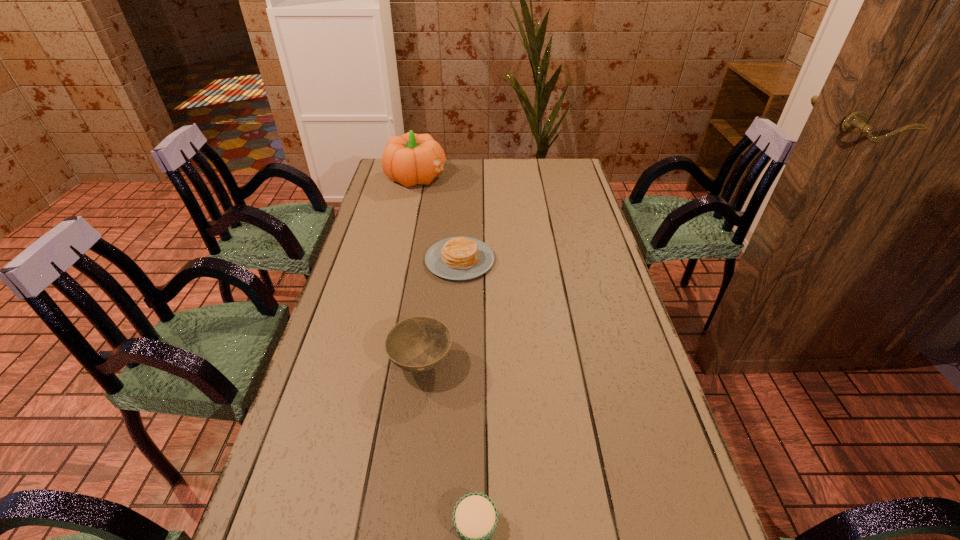
Where is `object that is at the left edge`? The width and height of the screenshot is (960, 540). object that is at the left edge is located at coordinates (410, 159).

This screenshot has height=540, width=960. Find the location of `object that is at the far left corner`. object that is at the far left corner is located at coordinates (410, 159).

Image resolution: width=960 pixels, height=540 pixels. In the image, there is a desktop. In order to click on free space at the far edge in this screenshot , I will do `click(444, 174)`.

In the image, there is a desktop. Where is `vacant space at the left edge`? vacant space at the left edge is located at coordinates (274, 523).

Locate an element on the screen. Image resolution: width=960 pixels, height=540 pixels. blank space at the right edge is located at coordinates (657, 429).

I want to click on vacant point located between the bowl and the second farthest object, so click(x=441, y=311).

The image size is (960, 540). Identify the location of unoccupied area between the second shortest object and the farthest object. (438, 218).

This screenshot has width=960, height=540. Identify the location of empty location between the pancake and the third farthest object. (441, 311).

Find the location of `free space that is in between the bowl and the pumpkin`. free space that is in between the bowl and the pumpkin is located at coordinates (419, 270).

You are a GUI agent. You are given a task and a screenshot of the screen. Output one action in this format:
    pyautogui.click(x=<x>, y=<y>)
    Task: Click on the object that is the closest to the shortest object
    
    Given the screenshot: What is the action you would take?
    pyautogui.click(x=417, y=344)